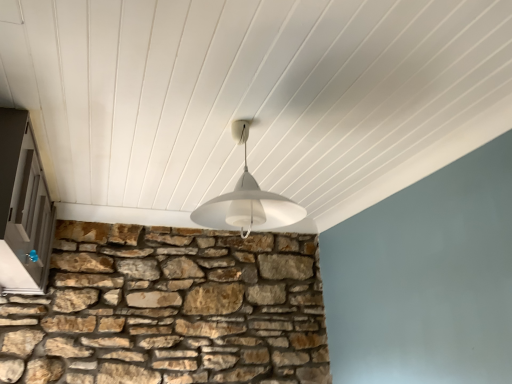
Question: Is matte gray door at left spatially inside white matte lampshade at center, or outside of it?

Choices:
 (A) outside
 (B) inside

Answer: (A)

Question: Is matte gray door at left taller or shorter than white matte lampshade at center?

Choices:
 (A) tall
 (B) short

Answer: (A)

Question: Visually, is matte gray door at left positioned to the left or to the right of white matte lampshade at center?

Choices:
 (A) right
 (B) left

Answer: (B)

Question: Is white matte lampshade at center taller or shorter than matte gray door at left?

Choices:
 (A) tall
 (B) short

Answer: (B)

Question: Which is correct: white matte lampshade at center is inside matte gray door at left, or outside of it?

Choices:
 (A) inside
 (B) outside

Answer: (B)

Question: From the image's perspective, is white matte lampshade at center located above or below matte gray door at left?

Choices:
 (A) above
 (B) below

Answer: (A)

Question: Relative to matte gray door at left, is white matte lampshade at center in front or behind?

Choices:
 (A) behind
 (B) front

Answer: (A)